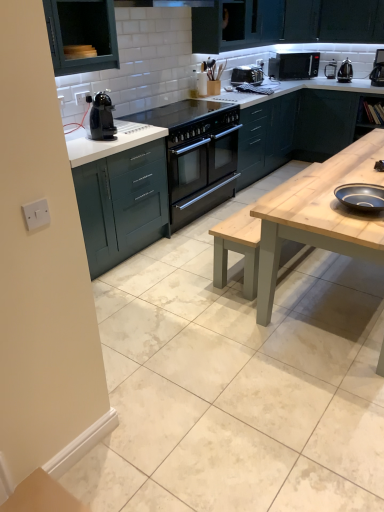
Question: Is black glass cooktop at center taller or shorter than black matte microwave at upper right?

Choices:
 (A) tall
 (B) short

Answer: (B)

Question: Looking at their shapes, would you say black glass cooktop at center is wider or thinner than black matte microwave at upper right?

Choices:
 (A) thin
 (B) wide

Answer: (B)

Question: Which is farther from the black glass cooktop at center?

Choices:
 (A) black metallic kettle at upper right, the 1th appliance positioned from the right
 (B) black matte microwave at upper right
 (C) black plastic coffee machine at upper right
 (D) teal matte cabinet at left, marked as the second cabinetry in a left-to-right arrangement
 (E) matte blue bowl at center, the first appliance when ordered from bottom to top

Answer: (E)

Question: Which object is positioned farthest from the teal matte cabinet at left, marked as the second cabinetry in a left-to-right arrangement?

Choices:
 (A) black plastic coffee machine at upper left
 (B) matte blue bowl at center, the 1th appliance when ordered from front to back
 (C) teal wood cabinet at upper left, arranged as the 1th cabinetry when viewed from the left
 (D) black glass cooktop at center
 (E) black plastic coffee machine at upper right

Answer: (E)